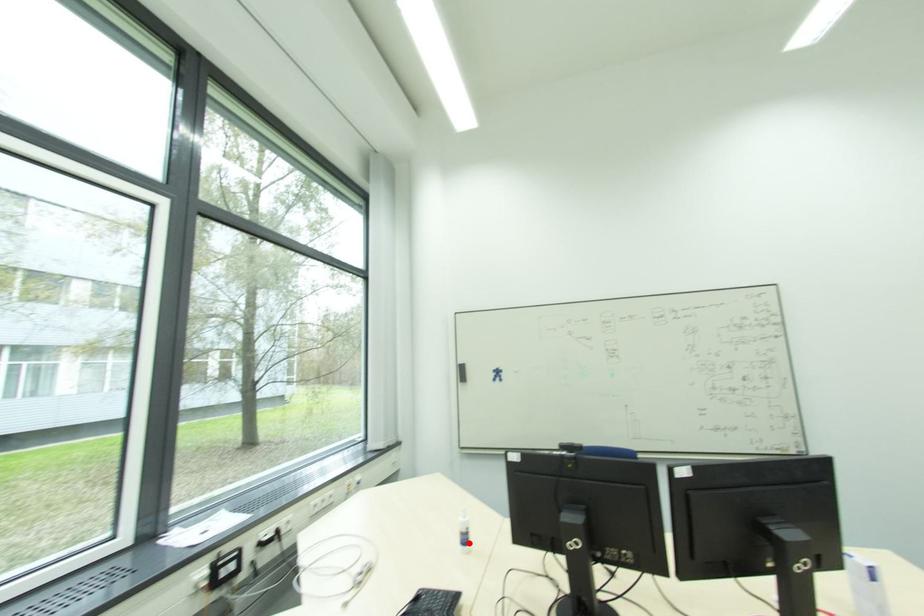
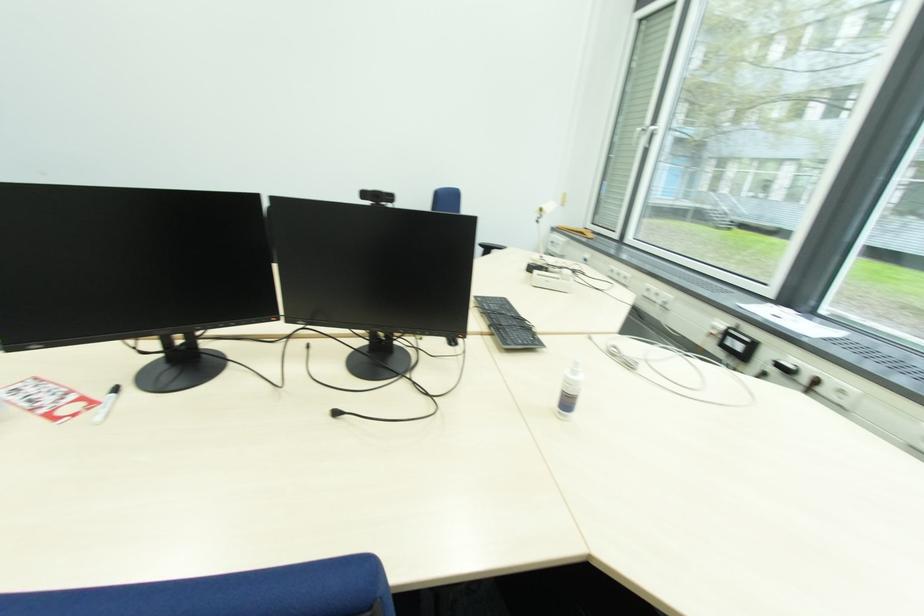
Locate, in the second image, the point that corresponds to the highlighted location in the first image.

(570, 405)